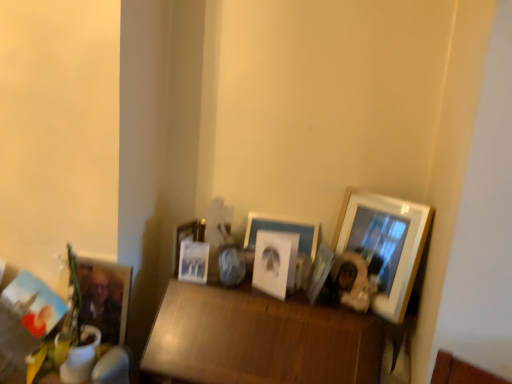
Question: Would you say wooden table at center is inside or outside matte white picture frame at center, which is the second picture frame in right-to-left order?

Choices:
 (A) inside
 (B) outside

Answer: (B)

Question: In the image, is wooden table at center on the left side or the right side of matte white picture frame at center, which is the second picture frame in right-to-left order?

Choices:
 (A) right
 (B) left

Answer: (B)

Question: Estimate the real-world distances between objects in this image. Which object is farther from the matte white picture frame at center, which is the second picture frame in right-to-left order?

Choices:
 (A) matte white picture frame at center, positioned as the 3th picture frame in left-to-right order
 (B) wooden picture frame at right, arranged as the 8th picture frame when viewed from the left
 (C) metallic silver photo frame at center, the 5th picture frame positioned from the right
 (D) white paper at center, positioned as the 6th picture frame in left-to-right order
 (E) matte wooden picture frame at lower left, the 2th picture frame from the left

Answer: (E)

Question: Which of these objects is positioned farthest from the wooden table at center?

Choices:
 (A) white paper at center, positioned as the 6th picture frame in left-to-right order
 (B) matte white picture frame at center, which is the second picture frame in right-to-left order
 (C) metallic silver photo frame at center, acting as the 4th picture frame starting from the left
 (D) matte white picture frame at center, positioned as the sixth picture frame in right-to-left order
 (E) matte black picture frame at lower left, placed as the first picture frame when sorted from left to right

Answer: (E)